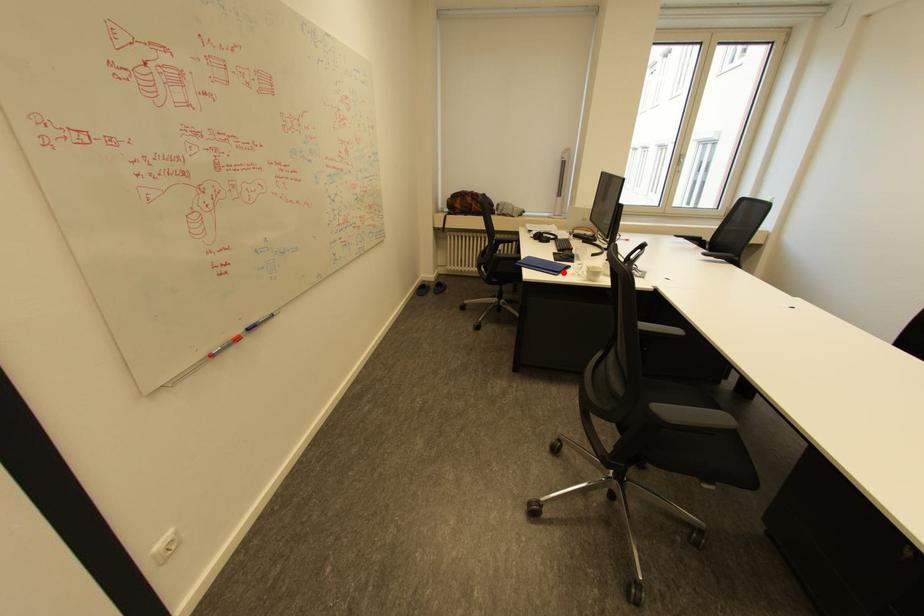
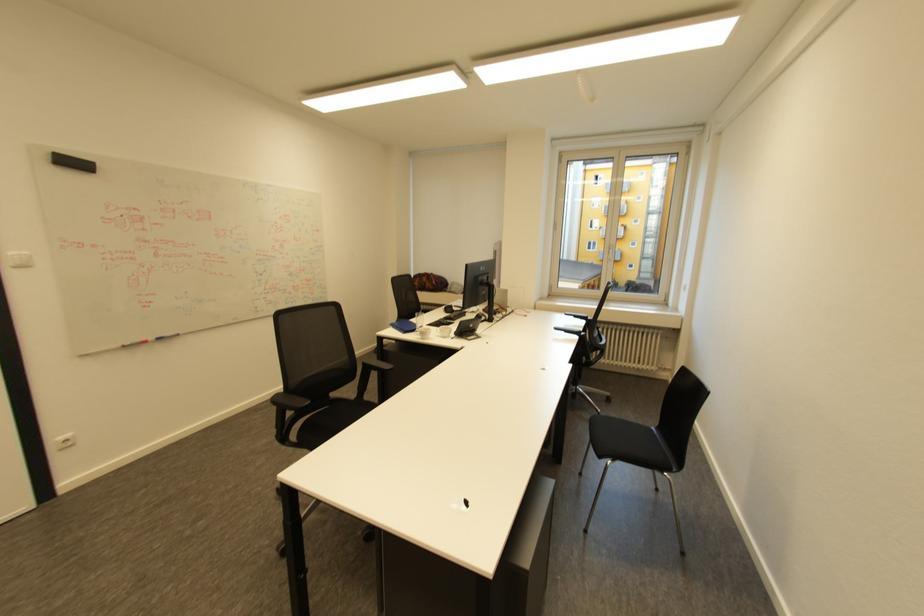
The point at the highlighted location is marked in the first image. Where is the corresponding point in the second image?

(411, 331)